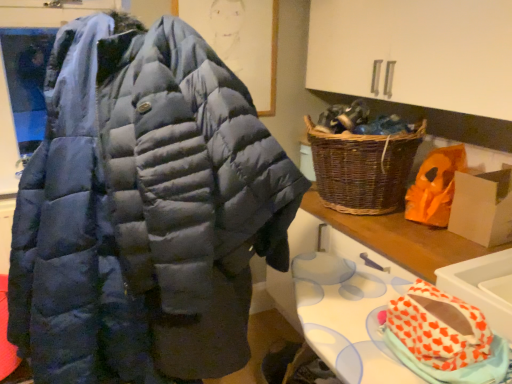
Question: Is orange paper bag at right placed right next to orange heart-patterned fabric at lower right?

Choices:
 (A) yes
 (B) no

Answer: (B)

Question: Is orange paper bag at right far from orange heart-patterned fabric at lower right?

Choices:
 (A) yes
 (B) no

Answer: (B)

Question: Can you confirm if orange paper bag at right is positioned to the right of orange heart-patterned fabric at lower right?

Choices:
 (A) no
 (B) yes

Answer: (B)

Question: Considering the relative sizes of orange paper bag at right and orange heart-patterned fabric at lower right in the image provided, is orange paper bag at right taller than orange heart-patterned fabric at lower right?

Choices:
 (A) no
 (B) yes

Answer: (B)

Question: Does orange paper bag at right lie behind orange heart-patterned fabric at lower right?

Choices:
 (A) yes
 (B) no

Answer: (A)

Question: Would you say orange heart-patterned fabric at lower right is to the left or to the right of white glossy sink at lower right in the picture?

Choices:
 (A) right
 (B) left

Answer: (B)

Question: From a real-world perspective, is orange heart-patterned fabric at lower right above or below white glossy sink at lower right?

Choices:
 (A) above
 (B) below

Answer: (A)

Question: Considering the positions of orange heart-patterned fabric at lower right and white glossy sink at lower right in the image, is orange heart-patterned fabric at lower right wider or thinner than white glossy sink at lower right?

Choices:
 (A) thin
 (B) wide

Answer: (A)

Question: In the image, is orange heart-patterned fabric at lower right positioned in front of or behind white glossy sink at lower right?

Choices:
 (A) front
 (B) behind

Answer: (A)

Question: Considering the positions of woven brown picnic basket at right and navy blue puffer jacket at center in the image, is woven brown picnic basket at right bigger or smaller than navy blue puffer jacket at center?

Choices:
 (A) big
 (B) small

Answer: (B)

Question: Would you say woven brown picnic basket at right is to the left or to the right of navy blue puffer jacket at center in the picture?

Choices:
 (A) left
 (B) right

Answer: (B)

Question: From a real-world perspective, is woven brown picnic basket at right physically located above or below navy blue puffer jacket at center?

Choices:
 (A) below
 (B) above

Answer: (B)

Question: From the image's perspective, is woven brown picnic basket at right located above or below navy blue puffer jacket at center?

Choices:
 (A) below
 (B) above

Answer: (B)

Question: Is navy blue puffer jacket at center wider or thinner than orange heart-patterned fabric at lower right?

Choices:
 (A) thin
 (B) wide

Answer: (B)

Question: Considering the positions of point (212, 248) and point (416, 294), is point (212, 248) closer or farther from the camera than point (416, 294)?

Choices:
 (A) closer
 (B) farther

Answer: (A)